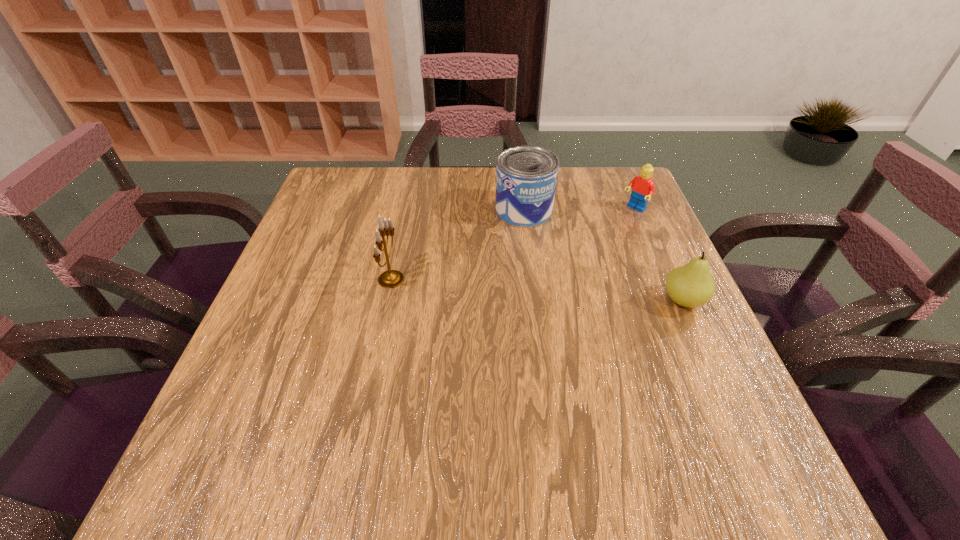
Locate an element on the screen. Image resolution: width=960 pixels, height=540 pixels. candelabrum is located at coordinates (392, 278).

The image size is (960, 540). I want to click on the tallest object, so click(392, 278).

The width and height of the screenshot is (960, 540). I want to click on pear, so click(691, 285).

The width and height of the screenshot is (960, 540). I want to click on the second object from left to right, so click(x=526, y=176).

Locate an element on the screen. This screenshot has height=540, width=960. Lego is located at coordinates (643, 187).

You are a GUI agent. You are given a task and a screenshot of the screen. Output one action in this format:
    pyautogui.click(x=<x>, y=<y>)
    Task: Click on the blank space located 0.320m on the right of the leftmost object
    The height and width of the screenshot is (540, 960).
    Given the screenshot: What is the action you would take?
    pyautogui.click(x=546, y=279)

Find the location of a particular element. The image size is (960, 540). vacant space located 0.310m on the left of the pear is located at coordinates [x=516, y=301].

Where is `free space located 0.290m on the front label of the third object from right to left`? free space located 0.290m on the front label of the third object from right to left is located at coordinates (540, 313).

This screenshot has height=540, width=960. I want to click on vacant area situated 0.110m on the front label of the third object from right to left, so click(531, 256).

Identify the location of vacant space situated on the front label of the third object from right to left. The image size is (960, 540). (529, 246).